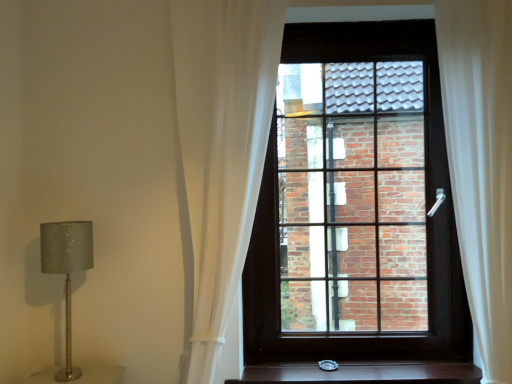
Question: From a real-world perspective, relative to white sheer curtain at center, the 2th curtain in the right-to-left sequence, is silver textured lamp at left vertically above or below?

Choices:
 (A) above
 (B) below

Answer: (B)

Question: From the image's perspective, is silver textured lamp at left above or below white sheer curtain at center, the 2th curtain in the right-to-left sequence?

Choices:
 (A) above
 (B) below

Answer: (B)

Question: Considering the real-world distances, which object is closest to the white sheer curtain at right, which is the 2th curtain from left to right?

Choices:
 (A) silver textured lamp at left
 (B) matte dark wood window at center
 (C) white sheer curtain at center, the 2th curtain in the right-to-left sequence
 (D) wooden stair treads at lower center

Answer: (B)

Question: Which object is positioned closest to the matte dark wood window at center?

Choices:
 (A) white sheer curtain at center, the 1th curtain when ordered from left to right
 (B) white sheer curtain at right, which is the 2th curtain from left to right
 (C) wooden stair treads at lower center
 (D) silver textured lamp at left

Answer: (B)